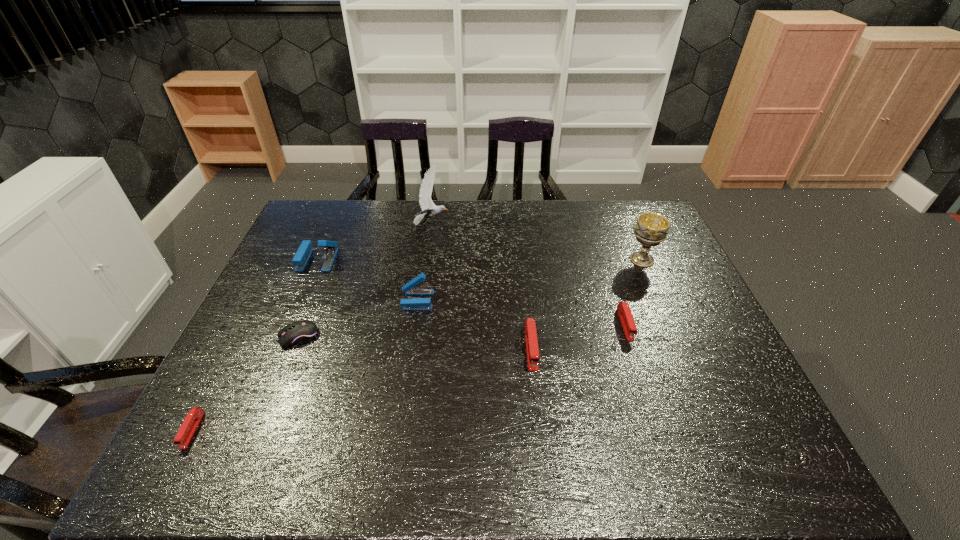
You are a GUI agent. You are given a task and a screenshot of the screen. Output one action in this format:
    pyautogui.click(x=<x>, y=<y>)
    Task: Click on the rightmost red stapler
    
    Given the screenshot: What is the action you would take?
    pyautogui.click(x=624, y=311)

What are the coordinates of `computer mouse` in the screenshot? It's located at coord(300,332).

Locate an element on the screen. This screenshot has height=540, width=960. the leftmost stapler is located at coordinates (193, 418).

Identify the location of the leftmost red stapler. (193, 418).

This screenshot has width=960, height=540. Find the location of `free location located at the tip of the beak of the gull`. free location located at the tip of the beak of the gull is located at coordinates (526, 225).

Identify the location of vacant area situated on the left of the rightmost object. (541, 260).

At what (x,y) coordinates should I click in order to perform the action: click on vacant space located on the back of the farthest stapler. Please return your answer as a coordinate pair (x, y). Image resolution: width=960 pixels, height=540 pixels. Looking at the image, I should click on (328, 235).

This screenshot has height=540, width=960. In order to click on vacant region located on the left of the nearer blue stapler in this screenshot , I will do `click(286, 300)`.

I want to click on free point located on the front-facing side of the second stapler from right to left, so click(x=536, y=389).

Find the location of a particular element. This screenshot has height=540, width=960. free location located on the front-facing side of the second biggest red stapler is located at coordinates pos(643,380).